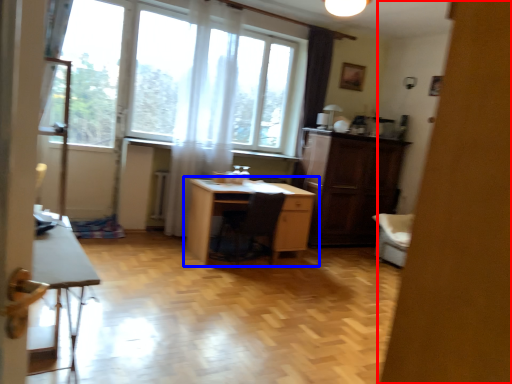
Question: Which object is closer to the camera taking this photo, screen door (highlighted by a red box) or desk (highlighted by a blue box)?

Choices:
 (A) screen door
 (B) desk

Answer: (A)